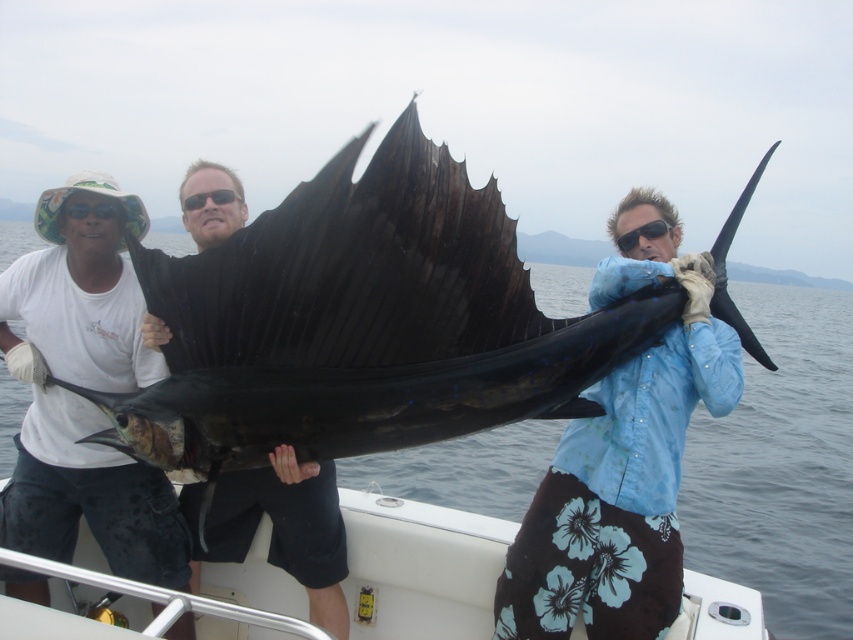
Question: Which object is the farthest from the blue fabric shirt at center?

Choices:
 (A) blue water at center
 (B) shiny black sailfish at center
 (C) smooth black fish at center

Answer: (A)

Question: Is shiny black sailfish at center thinner than smooth black fish at center?

Choices:
 (A) yes
 (B) no

Answer: (B)

Question: Can you confirm if blue fabric shirt at center is positioned to the right of smooth black fish at center?

Choices:
 (A) yes
 (B) no

Answer: (A)

Question: Which is nearer to the shiny black sailfish at center?

Choices:
 (A) blue fabric shirt at center
 (B) blue water at center

Answer: (A)

Question: Which is farther from the blue water at center?

Choices:
 (A) shiny black sailfish at center
 (B) smooth black fish at center
 (C) blue fabric shirt at center

Answer: (B)

Question: Does blue water at center have a smaller size compared to blue fabric shirt at center?

Choices:
 (A) yes
 (B) no

Answer: (B)